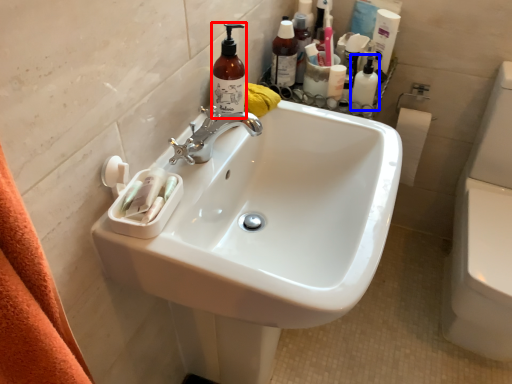
Question: Which object appears closest to the camera in this image, cleaning product (highlighted by a red box) or toiletry (highlighted by a blue box)?

Choices:
 (A) cleaning product
 (B) toiletry

Answer: (A)